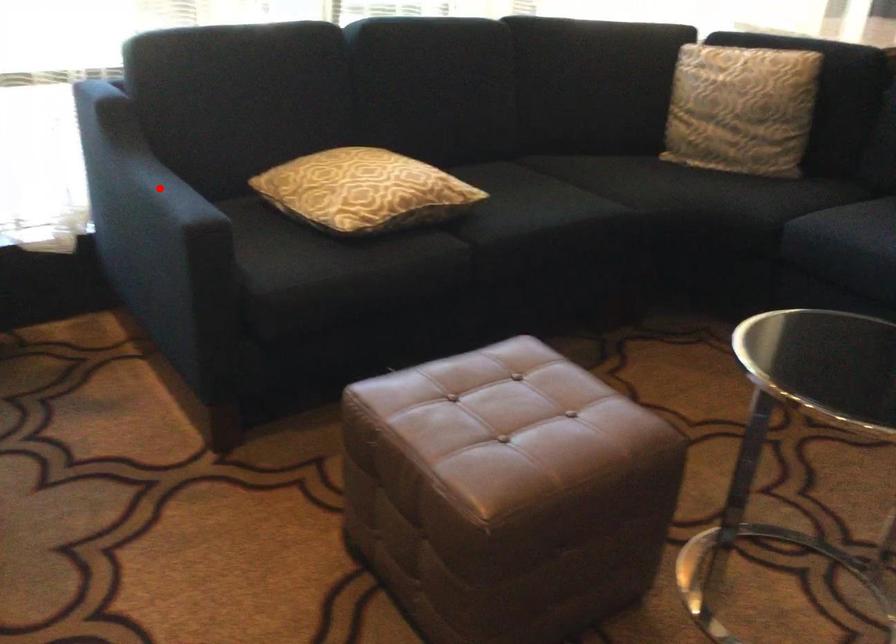
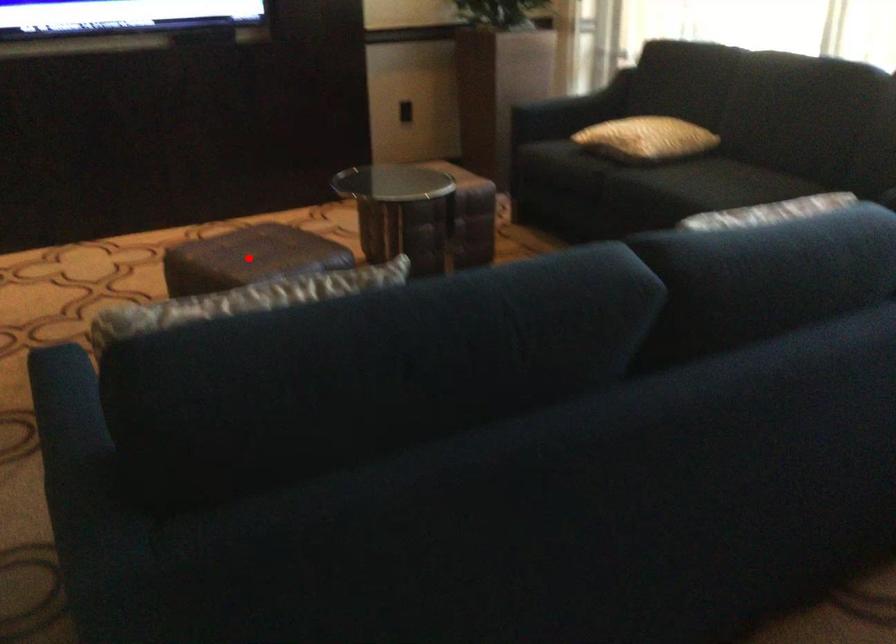
I am providing you with two images of the same scene from different viewpoints. A red point is marked on the first image and another point is marked on the second image. Is the marked point in image1 the same physical position as the marked point in image2?

No